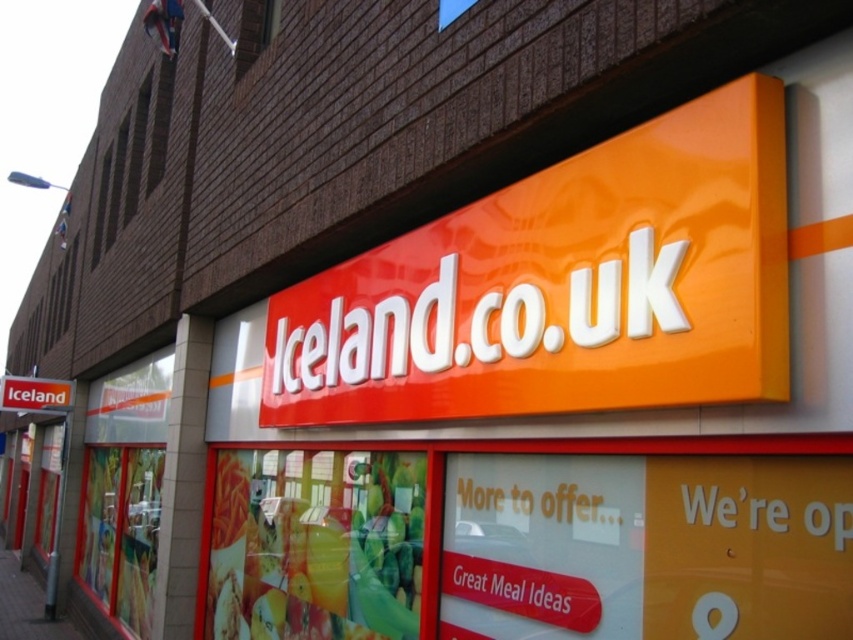
Question: Among these points, which one is nearest to the camera?

Choices:
 (A) (47, 397)
 (B) (483, 269)
 (C) (9, 627)

Answer: (B)

Question: Does orange glossy sign at upper center have a larger size compared to smooth concrete pavement at lower left?

Choices:
 (A) no
 (B) yes

Answer: (A)

Question: Considering the relative positions of orange glossy sign at upper center and smooth concrete pavement at lower left in the image provided, where is orange glossy sign at upper center located with respect to smooth concrete pavement at lower left?

Choices:
 (A) above
 (B) below

Answer: (A)

Question: Is smooth concrete pavement at lower left below orange glossy sign at center?

Choices:
 (A) yes
 (B) no

Answer: (A)

Question: Among these points, which one is farthest from the camera?

Choices:
 (A) (1, 410)
 (B) (41, 628)
 (C) (492, 227)

Answer: (A)

Question: Which of the following is the closest to the observer?

Choices:
 (A) (646, 152)
 (B) (0, 611)
 (C) (0, 400)

Answer: (A)